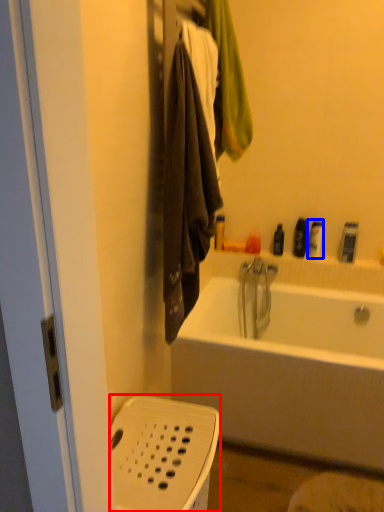
Question: Which point is further to the camera, basket (highlighted by a red box) or toiletry (highlighted by a blue box)?

Choices:
 (A) basket
 (B) toiletry

Answer: (B)